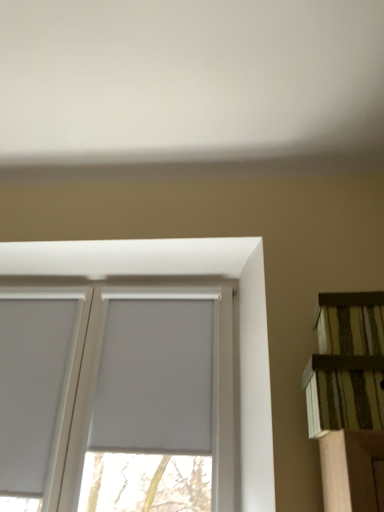
Question: In terms of size, does striped fabric shelf at right appear bigger or smaller than white matte window screen at center?

Choices:
 (A) small
 (B) big

Answer: (A)

Question: Is striped fabric shelf at right to the left or to the right of white matte window screen at center in the image?

Choices:
 (A) left
 (B) right

Answer: (B)

Question: Which object is the farthest from the striped fabric shelf at right?

Choices:
 (A) white matte window at center
 (B) white matte window screen at center

Answer: (B)

Question: Which is nearer to the striped fabric shelf at right?

Choices:
 (A) white matte window at center
 (B) white matte window screen at center

Answer: (A)